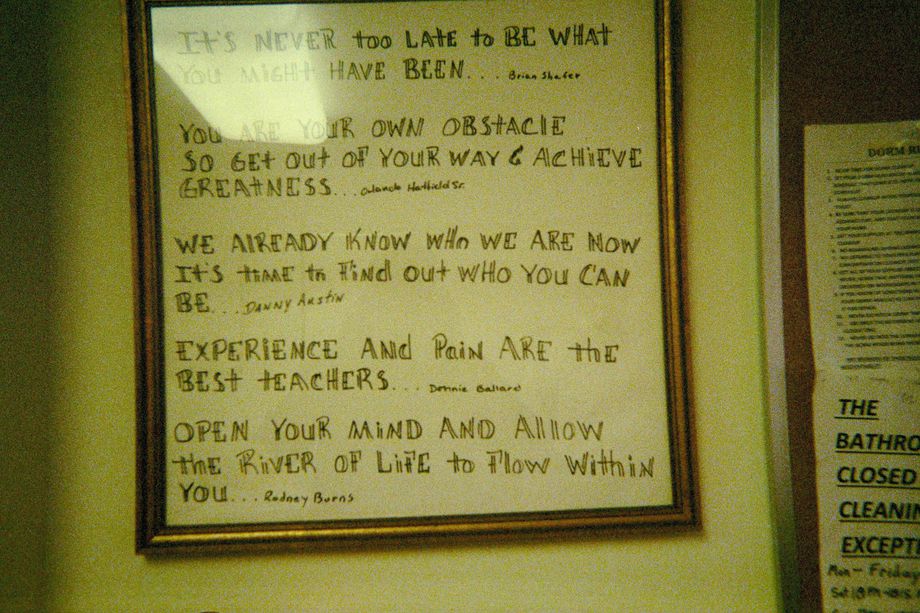
You are a GUI agent. You are given a task and a screenshot of the screen. Output one action in this format:
    pyautogui.click(x=<x>, y=<y>)
    Task: Click on the wall corner
    Image resolution: width=920 pixels, height=613 pixels.
    Given the screenshot: What is the action you would take?
    pyautogui.click(x=42, y=523), pyautogui.click(x=48, y=425), pyautogui.click(x=47, y=318), pyautogui.click(x=51, y=275)